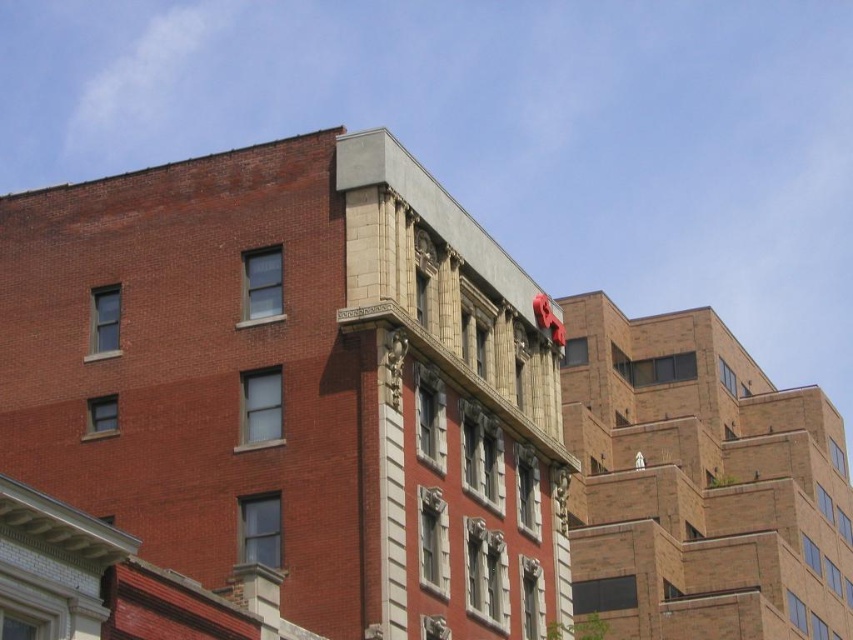
From the picture: You are an architect evaluating the building design. You need to determine which structure takes up more visual space in the image. Based on the scene, which one is larger in size between the smooth concrete peak at upper center and the brown brick building at upper right?

The smooth concrete peak at upper center occupies less space than the brown brick building at upper right, so the brown brick building at upper right is larger in size.

You are standing in front of the building and want to locate the smooth concrete peak at upper center. According to the coordinates provided, where would you look?

The smooth concrete peak at upper center is located at point coordinates of [294,385].